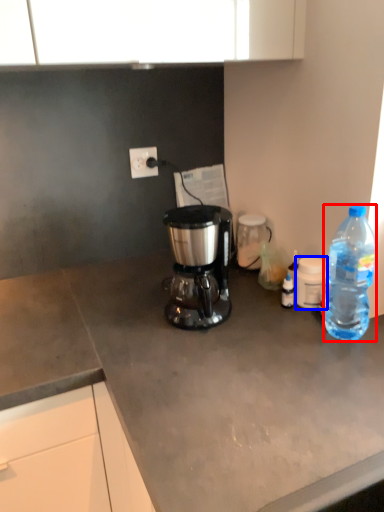
Question: Which point is further to the camera, bottle (highlighted by a red box) or coffee cup (highlighted by a blue box)?

Choices:
 (A) bottle
 (B) coffee cup

Answer: (B)